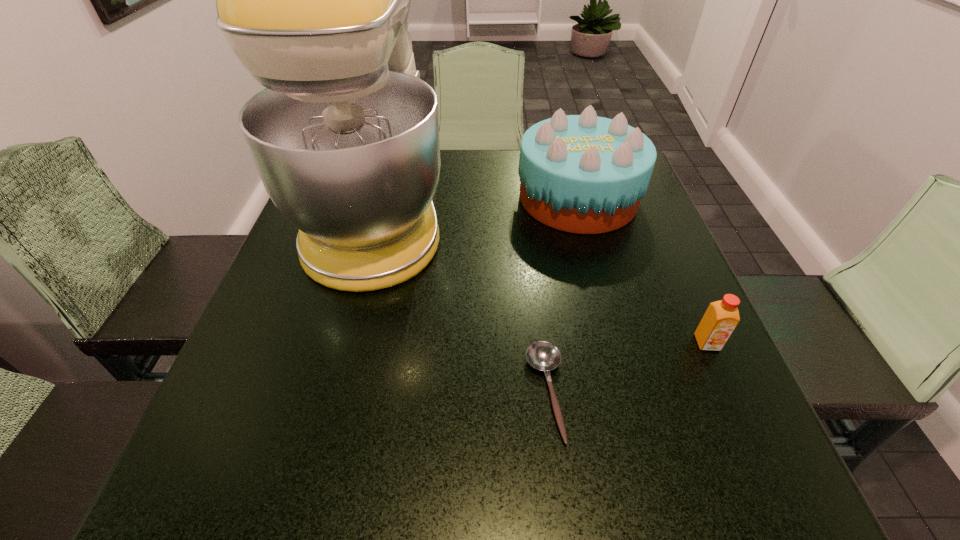
Image resolution: width=960 pixels, height=540 pixels. Identify the location of vacant area at the right edge of the desktop. (636, 269).

Locate an element on the screen. unoccupied position between the orange juice and the cake is located at coordinates (642, 271).

Identify the location of vacant area that lies between the third tallest object and the tallest object. This screenshot has height=540, width=960. (543, 278).

Locate an element on the screen. The image size is (960, 540). vacant area between the orange juice and the tallest object is located at coordinates (543, 278).

This screenshot has height=540, width=960. What are the coordinates of `free space between the mixer and the orange juice` in the screenshot? It's located at (543, 278).

Locate an element on the screen. The width and height of the screenshot is (960, 540). free space between the third shortest object and the ladle is located at coordinates (563, 295).

Where is `free spot between the leftmost object and the second tallest object`? free spot between the leftmost object and the second tallest object is located at coordinates (479, 205).

Identify the location of free spot between the second shortest object and the tallest object. The width and height of the screenshot is (960, 540). (543, 278).

You are a GUI agent. You are given a task and a screenshot of the screen. Output one action in this format:
    pyautogui.click(x=<x>, y=<y>)
    Task: Click on the vacant point located between the ladle and the leftmost object
    
    Given the screenshot: What is the action you would take?
    pyautogui.click(x=463, y=302)

Image resolution: width=960 pixels, height=540 pixels. In order to click on free space between the tallest object and the third tallest object in this screenshot , I will do `click(543, 278)`.